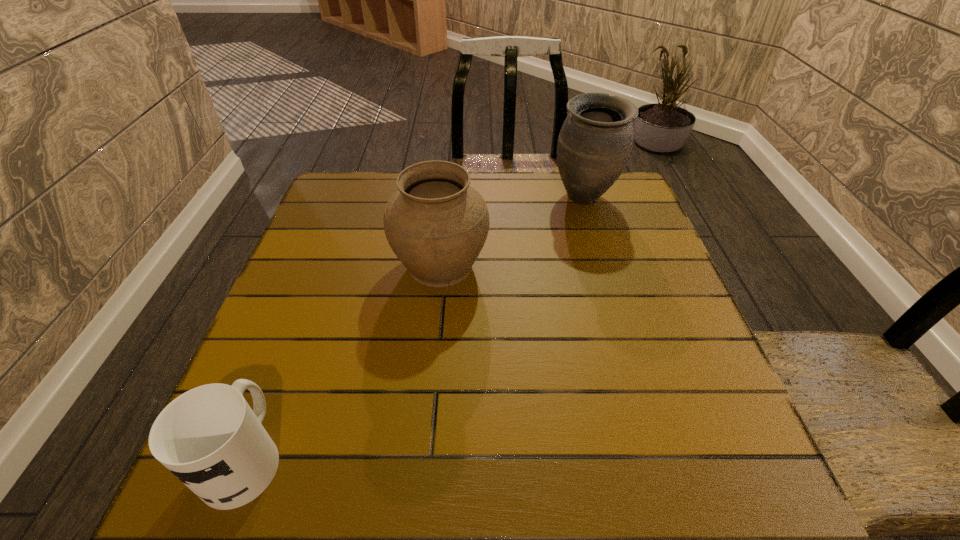
This screenshot has height=540, width=960. In order to click on the farther urn in this screenshot , I will do `click(595, 142)`.

I want to click on the right urn, so click(595, 142).

Find the location of a particular element. the second nearest object is located at coordinates (436, 224).

This screenshot has height=540, width=960. I want to click on the left urn, so click(436, 224).

Identify the location of the leftmost object. This screenshot has height=540, width=960. coord(209,437).

Where is `the shortest object`? The width and height of the screenshot is (960, 540). the shortest object is located at coordinates (209, 437).

Image resolution: width=960 pixels, height=540 pixels. What are the coordinates of `free space located 0.340m on the left of the farther urn` in the screenshot? It's located at (430, 198).

Locate an element on the screen. Image resolution: width=960 pixels, height=540 pixels. free spot located on the back of the second nearest object is located at coordinates (445, 212).

At what (x,y) coordinates should I click in order to perform the action: click on vacant space situated on the handle side of the mug. Please return your answer as a coordinate pair (x, y). Looking at the image, I should click on tap(306, 298).

Where is `vacant space located on the handle side of the mug`? The image size is (960, 540). vacant space located on the handle side of the mug is located at coordinates (322, 259).